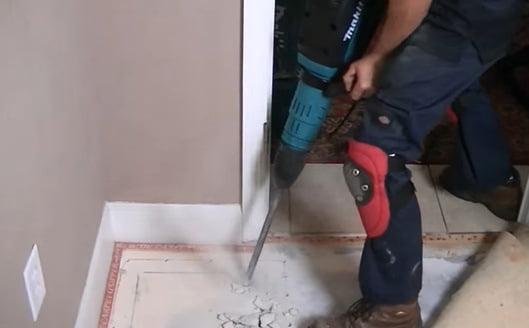
I want to click on floral rug, so click(x=348, y=130).